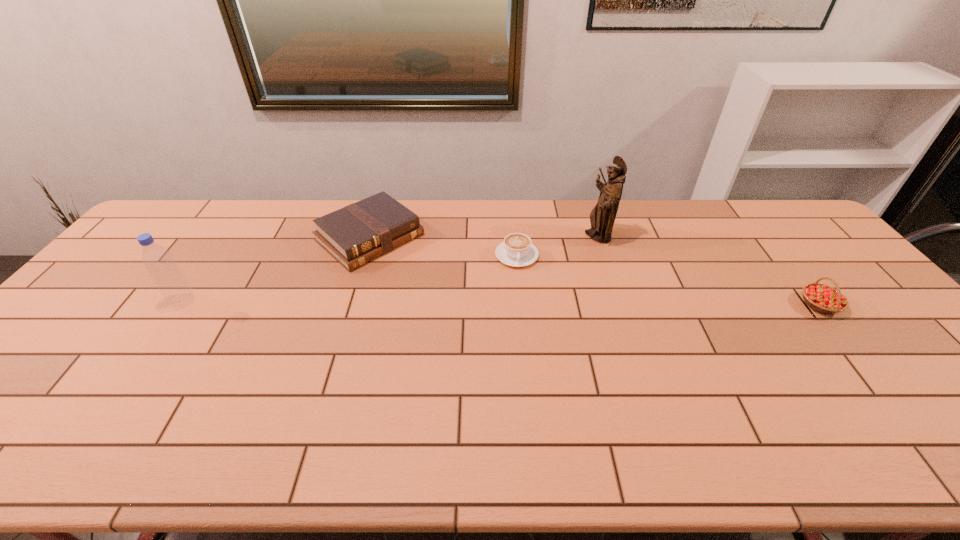
Identify the location of Bible that is at the far edge. The height and width of the screenshot is (540, 960). (360, 232).

Locate an element on the screen. The width and height of the screenshot is (960, 540). object present at the right edge is located at coordinates (822, 298).

Locate an element on the screen. vacant region at the far edge of the desktop is located at coordinates point(438,199).

This screenshot has width=960, height=540. I want to click on vacant space at the near edge of the desktop, so click(186, 393).

In order to click on free space at the left edge of the desktop in this screenshot , I will do (x=99, y=340).

What are the coordinates of `free space at the right edge` in the screenshot? It's located at (826, 253).

Find the location of `vacant space at the near left corner`. vacant space at the near left corner is located at coordinates (14, 403).

Identify the location of free location at the near right corner. This screenshot has width=960, height=540. (955, 411).

Locate an element on the screen. The width and height of the screenshot is (960, 540). vacant space in between the second object from left to right and the bottle is located at coordinates (276, 269).

Where is `empty location between the second tallest object and the Bible`? The height and width of the screenshot is (540, 960). empty location between the second tallest object and the Bible is located at coordinates (276, 269).